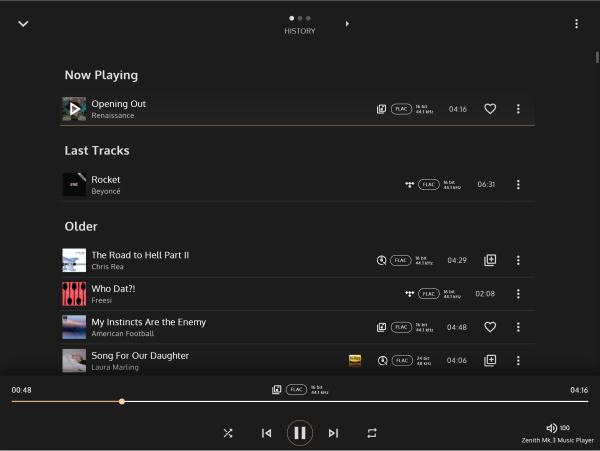
The height and width of the screenshot is (451, 600). I want to click on square thumbnail picture, so click(72, 360), click(77, 324), click(73, 292), click(75, 267), click(73, 183), click(77, 108).